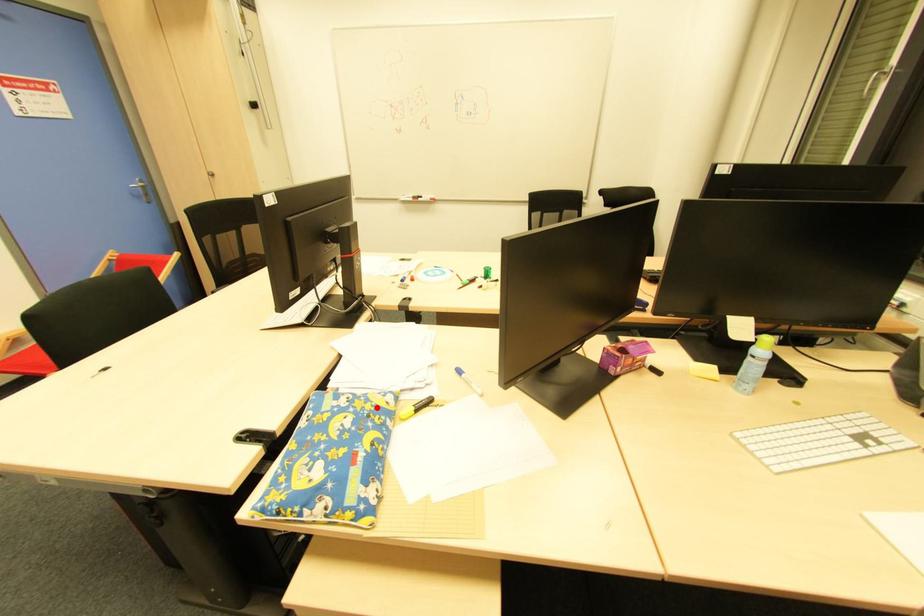
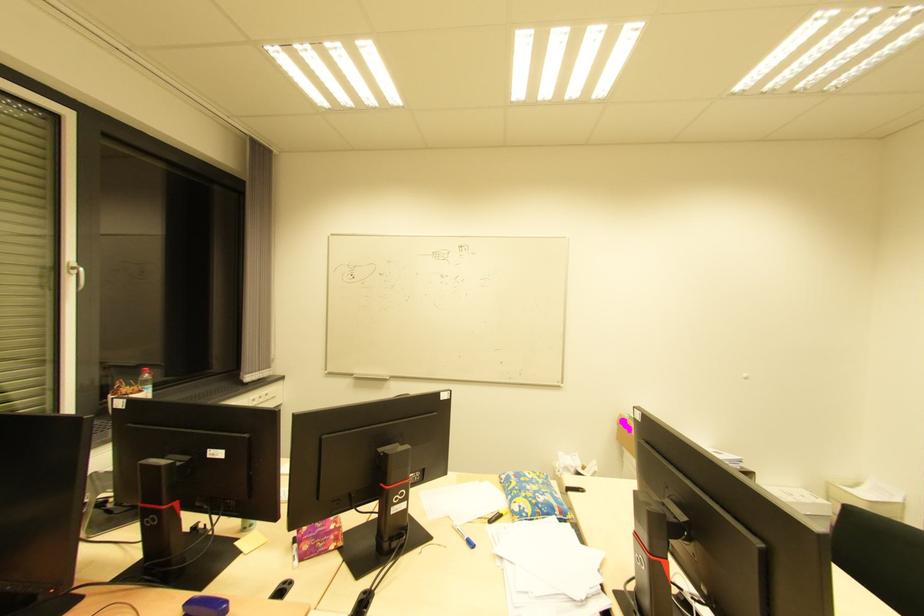
The point at the highlighted location is marked in the first image. Where is the corresponding point in the second image?

(518, 498)